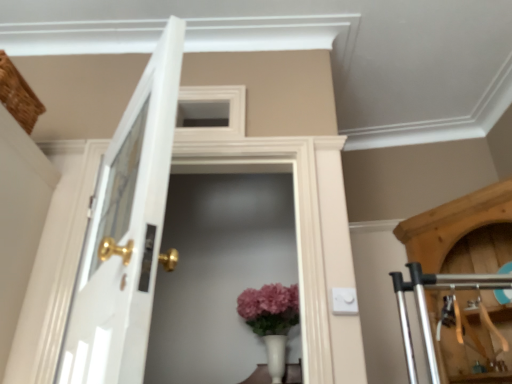
Question: Is white glass screen door at center looking in the opposite direction of white glossy door at left?

Choices:
 (A) no
 (B) yes

Answer: (A)

Question: Is the surface of white glass screen door at center in direct contact with white glossy door at left?

Choices:
 (A) no
 (B) yes

Answer: (A)

Question: Could you tell me if white glass screen door at center is turned towards white glossy door at left?

Choices:
 (A) yes
 (B) no

Answer: (A)

Question: Does white glass screen door at center lie behind white glossy door at left?

Choices:
 (A) no
 (B) yes

Answer: (B)

Question: From the image's perspective, would you say white glass screen door at center is positioned over white glossy door at left?

Choices:
 (A) yes
 (B) no

Answer: (B)

Question: Considering the relative sizes of white glass screen door at center and white glossy door at left in the image provided, is white glass screen door at center thinner than white glossy door at left?

Choices:
 (A) no
 (B) yes

Answer: (B)

Question: Is white glass screen door at center thinner than matte white vase at center?

Choices:
 (A) yes
 (B) no

Answer: (A)

Question: Does white glass screen door at center appear on the right side of matte white vase at center?

Choices:
 (A) yes
 (B) no

Answer: (B)

Question: Does white glass screen door at center come in front of matte white vase at center?

Choices:
 (A) yes
 (B) no

Answer: (A)

Question: Is white glass screen door at center completely or partially outside of matte white vase at center?

Choices:
 (A) no
 (B) yes

Answer: (B)

Question: Does white glass screen door at center appear on the left side of matte white vase at center?

Choices:
 (A) yes
 (B) no

Answer: (A)

Question: Considering the relative sizes of white glass screen door at center and matte white vase at center in the image provided, is white glass screen door at center bigger than matte white vase at center?

Choices:
 (A) yes
 (B) no

Answer: (A)

Question: Considering the relative sizes of white glossy door at left and white glass screen door at center in the image provided, is white glossy door at left shorter than white glass screen door at center?

Choices:
 (A) yes
 (B) no

Answer: (A)